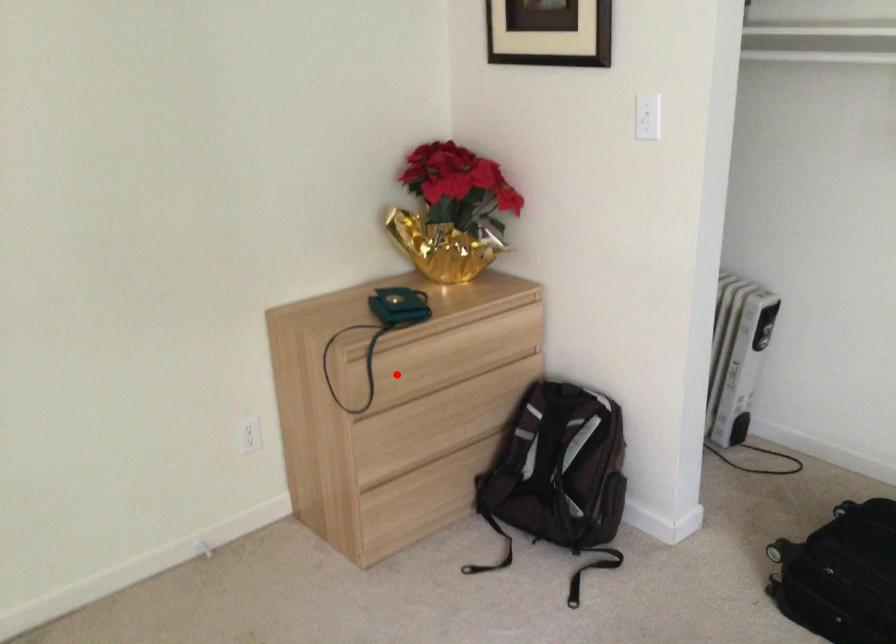
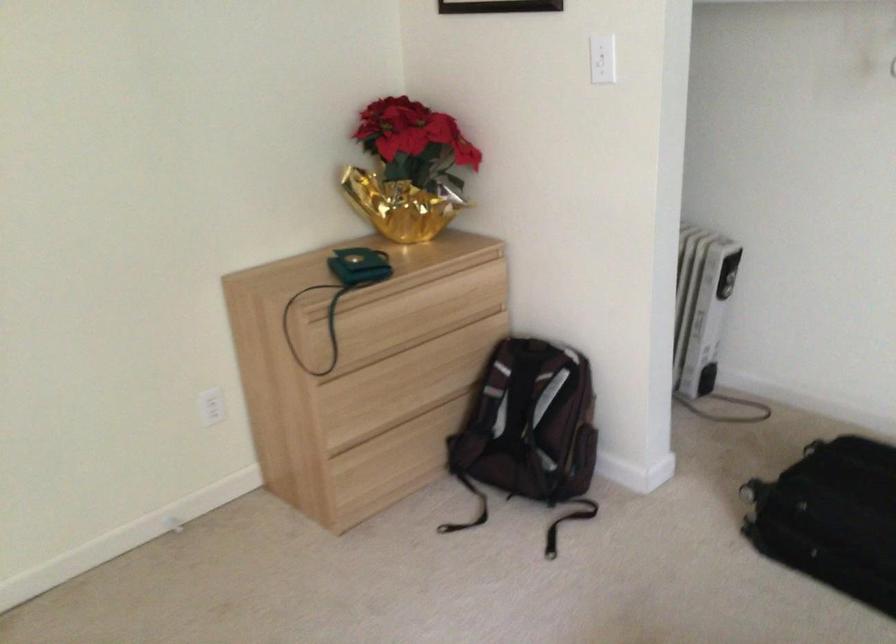
Locate, in the second image, the point that corresponds to the highlighted location in the first image.

(362, 335)